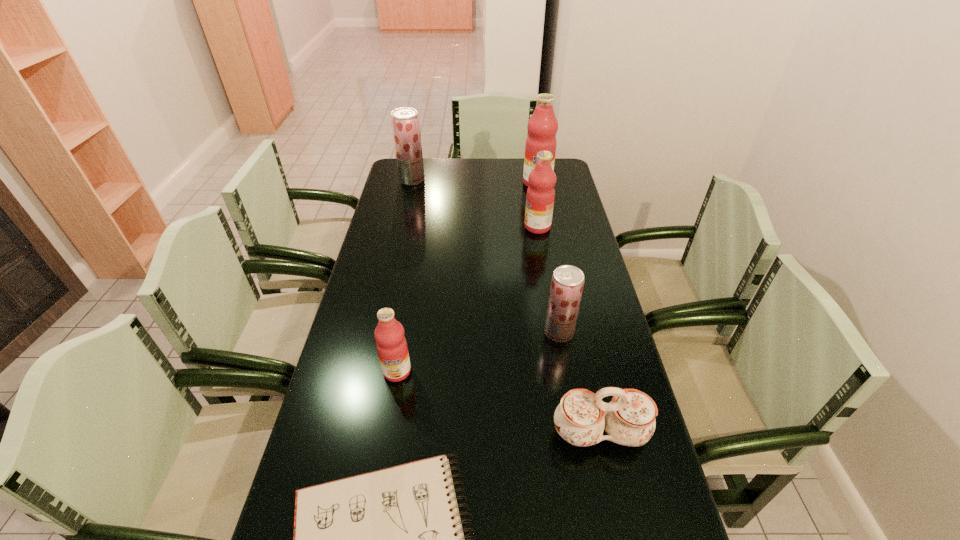
Where is `the biggest pink fruit juice`? the biggest pink fruit juice is located at coordinates (542, 127).

You are a GUI agent. You are given a task and a screenshot of the screen. Output one action in this format:
    pyautogui.click(x=<x>, y=<y>)
    Task: Click on the tallest fruit juice
    
    Given the screenshot: What is the action you would take?
    pyautogui.click(x=542, y=127)

At what (x,y) coordinates should I click in order to perform the action: click on the farther strawberry fruit juice. Please return your answer as a coordinate pair (x, y). Looking at the image, I should click on (405, 123).

Locate an element on the screen. the left strawberry fruit juice is located at coordinates (405, 123).

You are a GUI agent. You are given a task and a screenshot of the screen. Output one action in this format:
    pyautogui.click(x=<x>, y=<y>)
    Task: Click on the third nearest fruit juice
    The image size is (960, 540).
    Given the screenshot: What is the action you would take?
    pyautogui.click(x=540, y=196)

Find the location of `the second smallest pink fruit juice`. the second smallest pink fruit juice is located at coordinates (540, 196).

In order to click on the smaller strawberry fruit juice in this screenshot , I will do `click(567, 283)`.

Locate an element on the screen. the fourth farthest fruit juice is located at coordinates (567, 283).

I want to click on the nearest pink fruit juice, so click(x=392, y=349).

This screenshot has height=540, width=960. In order to click on the smallest pink fruit juice in this screenshot , I will do `click(392, 349)`.